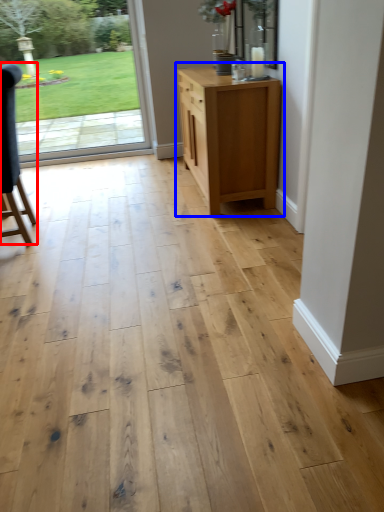
Question: Which of the following is the farthest to the observer, chair (highlighted by a red box) or chest of drawers (highlighted by a blue box)?

Choices:
 (A) chair
 (B) chest of drawers

Answer: (B)